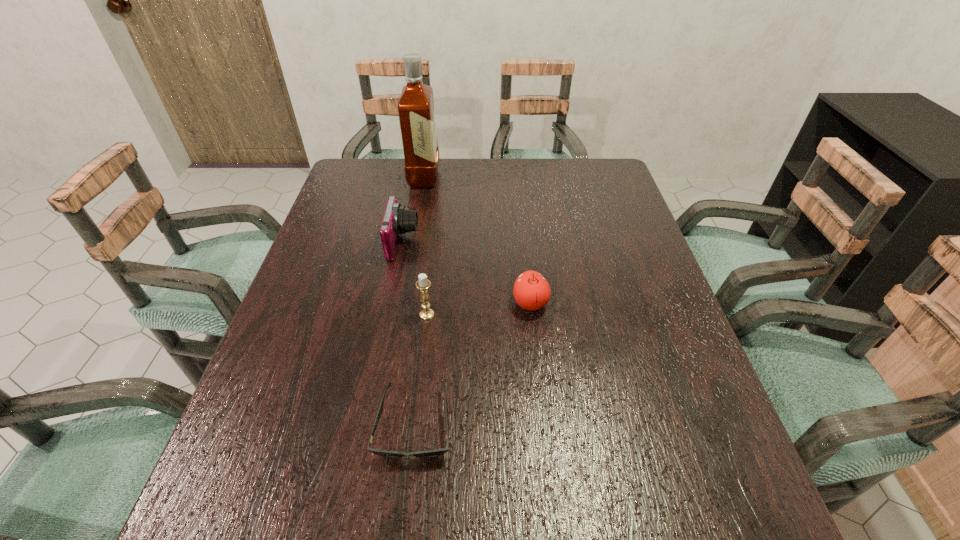
Find the location of a particular element. blank space located on the left of the rightmost object is located at coordinates (417, 303).

Find the location of a particular element. The image size is (960, 540). vacant space located on the front-facing side of the nearest object is located at coordinates pyautogui.click(x=401, y=534).

Locate an element on the screen. The height and width of the screenshot is (540, 960). object positioned at the far edge is located at coordinates (416, 112).

You are a GUI agent. You are given a task and a screenshot of the screen. Output one action in this format:
    pyautogui.click(x=<x>, y=<y>)
    Task: Click on the free location at the far edge
    
    Given the screenshot: What is the action you would take?
    pyautogui.click(x=556, y=164)

At what (x,y) coordinates should I click in order to perform the action: click on blank space at the left edge. Please return your answer as a coordinate pair (x, y). This screenshot has height=540, width=960. Looking at the image, I should click on (351, 271).

You are a GUI agent. You are given a task and a screenshot of the screen. Output one action in this format:
    pyautogui.click(x=<x>, y=<y>)
    Task: Click on the free location at the right edge
    This screenshot has height=540, width=960.
    Given the screenshot: What is the action you would take?
    pyautogui.click(x=621, y=280)

Identify the location of vacant space at the far left corner. (372, 165).

Where is `unoccupied position between the nearest object and the liquor`? unoccupied position between the nearest object and the liquor is located at coordinates (419, 301).

The image size is (960, 540). Find the location of `vacant space that's between the sunglasses and the camera`. vacant space that's between the sunglasses and the camera is located at coordinates (409, 334).

At what (x,y) coordinates should I click in order to perform the action: click on empty location between the second tallest object and the farthest object. Please return your answer as a coordinate pair (x, y). This screenshot has height=540, width=960. Looking at the image, I should click on (425, 246).